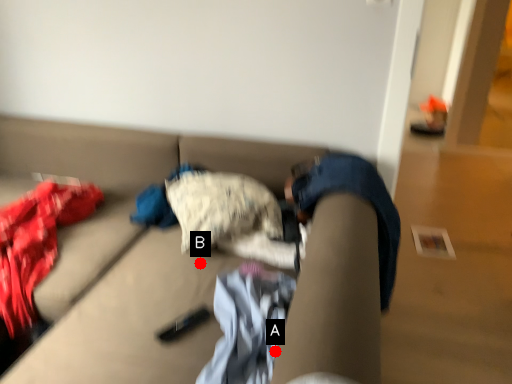
Question: Two points are circled on the image, labeled by A and B beside each circle. Which of the following is the farthest from the observer?

Choices:
 (A) A is further
 (B) B is further

Answer: (B)